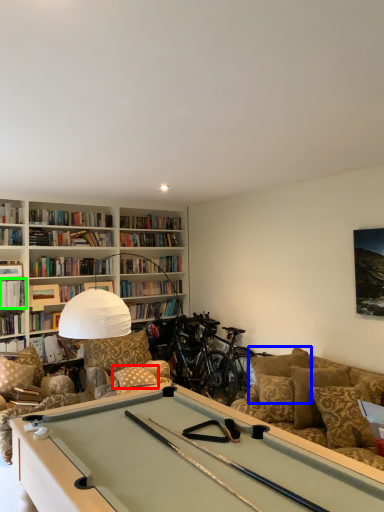
Question: Considering the real-world distances, which object is closest to pillow (highlighted by a red box)? pillow (highlighted by a blue box) or book (highlighted by a green box).

Choices:
 (A) pillow
 (B) book

Answer: (A)